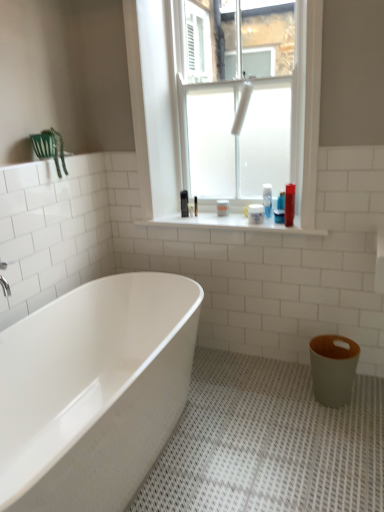
Question: Looking at their shapes, would you say frosted glass window at upper center is wider or thinner than matte plastic bottle at upper right, which is counted as the first toiletry, starting from the front?

Choices:
 (A) wide
 (B) thin

Answer: (B)

Question: In terms of size, does frosted glass window at upper center appear bigger or smaller than matte plastic bottle at upper right, the 1th toiletry when ordered from right to left?

Choices:
 (A) small
 (B) big

Answer: (B)

Question: Which is farther from the frosted glass window at upper center?

Choices:
 (A) matte plastic bottle at upper right, which is counted as the first toiletry, starting from the front
 (B) translucent plastic bottle at upper center, placed as the 2th toiletry when sorted from back to front
 (C) white matte container at upper center, which is the second toiletry in front-to-back order
 (D) matte gray toilet bowl at lower right
 (E) white glossy shelf at center

Answer: (D)

Question: Which is farther from the translucent plastic bottle at upper center, acting as the 3th toiletry starting from the front?

Choices:
 (A) matte gray toilet bowl at lower right
 (B) matte plastic bottle at upper right, the 4th toiletry viewed from the left
 (C) white glossy shelf at center
 (D) green fabric plant at upper left
 (E) translucent plastic container at center, the fourth toiletry when ordered from front to back

Answer: (D)